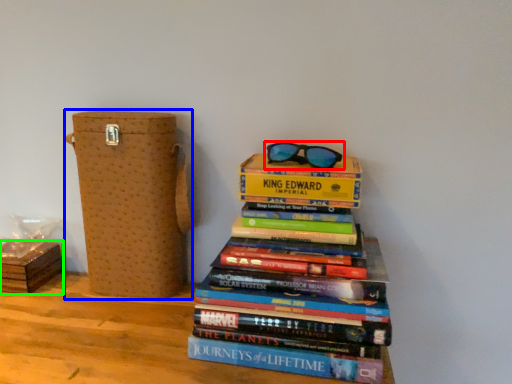
Question: Based on their relative distances, which object is farther from glasses (highlighted by a red box)? Choose from cardboard box (highlighted by a blue box) and cardboard box (highlighted by a green box).

Choices:
 (A) cardboard box
 (B) cardboard box

Answer: (B)